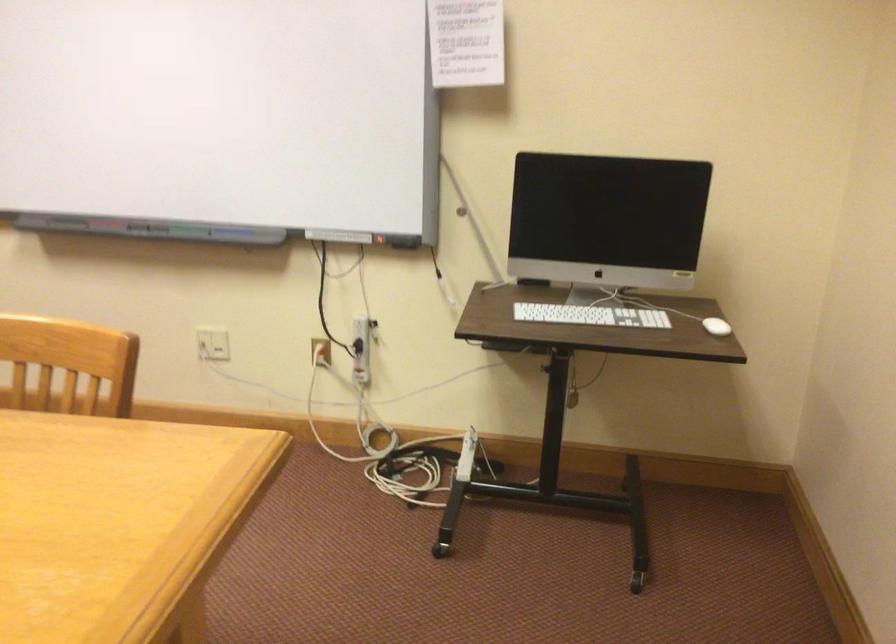
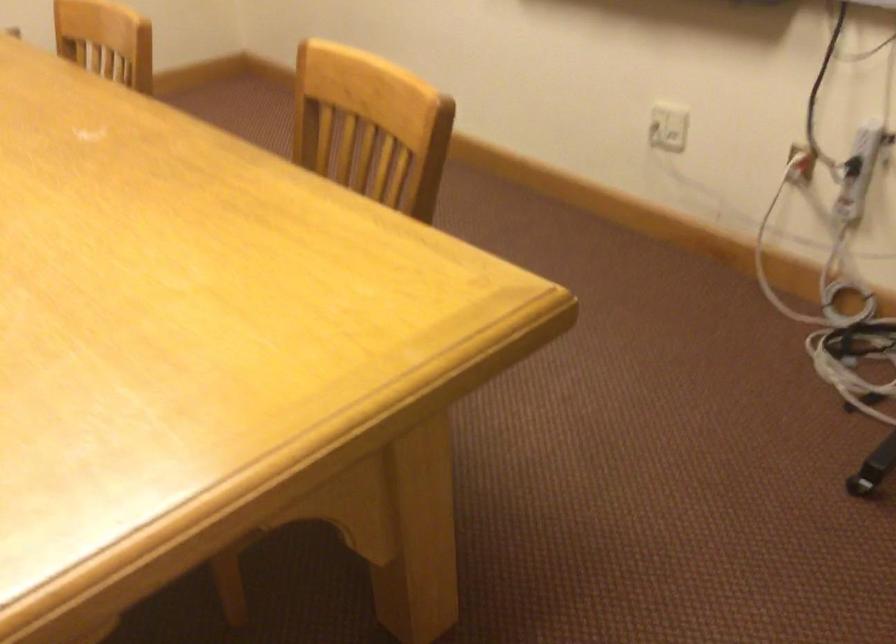
Find the pixel in the second image that matches (x=316, y=348) in the first image.

(800, 164)